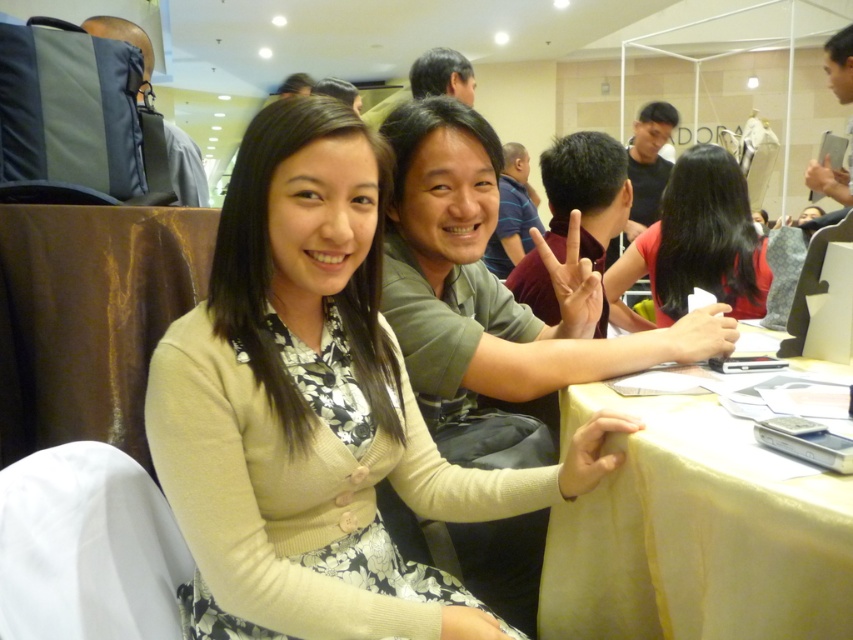
Question: Which point is closer to the camera?

Choices:
 (A) light beige sweater at center
 (B) black matte hair at center

Answer: (A)

Question: Is red matte shirt at center below matte green shirt at center?

Choices:
 (A) yes
 (B) no

Answer: (A)

Question: Which point appears closest to the camera in this image?

Choices:
 (A) (769, 332)
 (B) (682, 192)

Answer: (A)

Question: Is yellow fabric table at lower right above gray fabric backpack at upper left?

Choices:
 (A) yes
 (B) no

Answer: (B)

Question: Which object is farther from the camera taking this photo?

Choices:
 (A) matte green shirt at center
 (B) black matte hair at center
 (C) red matte shirt at center
 (D) yellow fabric table at lower right

Answer: (A)

Question: Does red matte shirt at center have a greater width compared to matte green shirt at center?

Choices:
 (A) no
 (B) yes

Answer: (A)